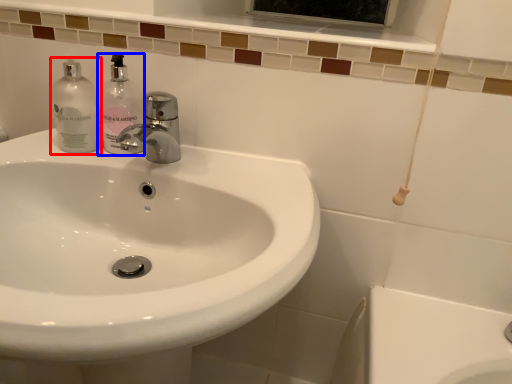
Question: Which object is closer to the camera taking this photo, cleaning product (highlighted by a red box) or soap dispenser (highlighted by a blue box)?

Choices:
 (A) cleaning product
 (B) soap dispenser

Answer: (B)